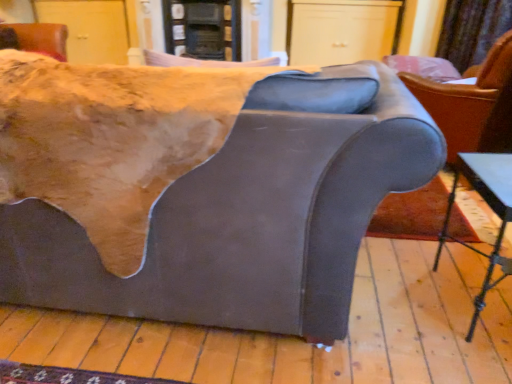
Question: Considering the relative sizes of velvet curtain at upper right and metallic silver table at lower right in the image provided, is velvet curtain at upper right wider than metallic silver table at lower right?

Choices:
 (A) yes
 (B) no

Answer: (B)

Question: Does velvet curtain at upper right have a greater height compared to metallic silver table at lower right?

Choices:
 (A) no
 (B) yes

Answer: (B)

Question: Does velvet curtain at upper right have a lesser height compared to metallic silver table at lower right?

Choices:
 (A) yes
 (B) no

Answer: (B)

Question: Is velvet curtain at upper right looking in the opposite direction of metallic silver table at lower right?

Choices:
 (A) yes
 (B) no

Answer: (B)

Question: Can you confirm if velvet curtain at upper right is bigger than metallic silver table at lower right?

Choices:
 (A) yes
 (B) no

Answer: (A)

Question: Is point (468, 84) closer or farther from the camera than point (454, 3)?

Choices:
 (A) farther
 (B) closer

Answer: (B)

Question: From a real-world perspective, is matte gray armchair at right positioned above or below velvet curtain at upper right?

Choices:
 (A) below
 (B) above

Answer: (A)

Question: Is matte gray armchair at right in front of or behind velvet curtain at upper right in the image?

Choices:
 (A) front
 (B) behind

Answer: (A)

Question: From the image's perspective, is matte gray armchair at right located above or below velvet curtain at upper right?

Choices:
 (A) below
 (B) above

Answer: (A)

Question: Based on their sizes in the image, would you say suede-like gray couch at center is bigger or smaller than velvet curtain at upper right?

Choices:
 (A) big
 (B) small

Answer: (A)

Question: Relative to velvet curtain at upper right, is suede-like gray couch at center in front or behind?

Choices:
 (A) behind
 (B) front

Answer: (B)

Question: In terms of width, does suede-like gray couch at center look wider or thinner when compared to velvet curtain at upper right?

Choices:
 (A) wide
 (B) thin

Answer: (A)

Question: From a real-world perspective, is suede-like gray couch at center physically located above or below velvet curtain at upper right?

Choices:
 (A) below
 (B) above

Answer: (A)

Question: From the image's perspective, is velvet curtain at upper right positioned above or below suede-like gray couch at center?

Choices:
 (A) below
 (B) above

Answer: (B)

Question: Is point click(480, 44) positioned closer to the camera than point click(314, 269)?

Choices:
 (A) farther
 (B) closer

Answer: (A)